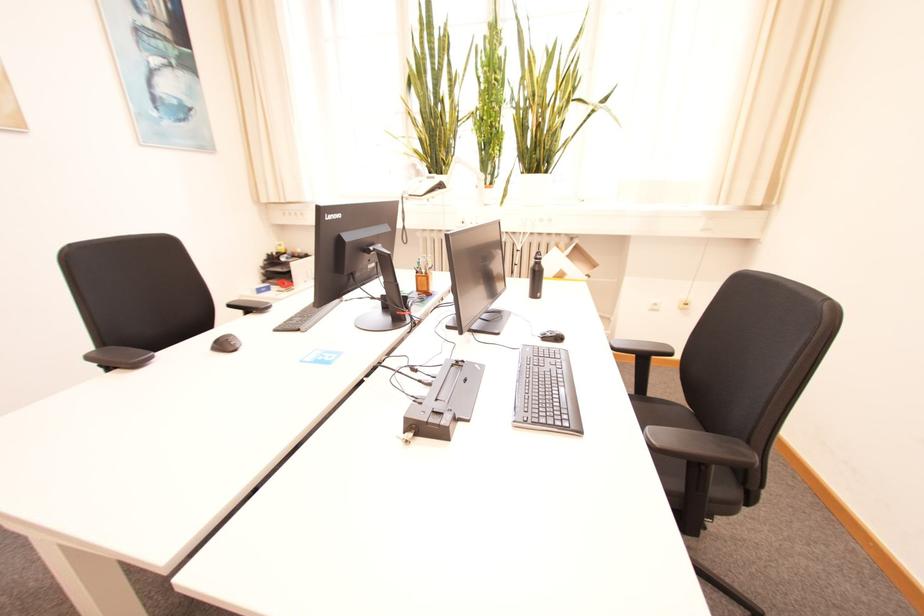
You are a GUI agent. You are given a task and a screenshot of the screen. Output one action in this format:
    pyautogui.click(x=<x>, y=<y>)
    Task: Click on the telephone handset
    The width and height of the screenshot is (924, 616).
    Given the screenshot: What is the action you would take?
    pyautogui.click(x=423, y=185)